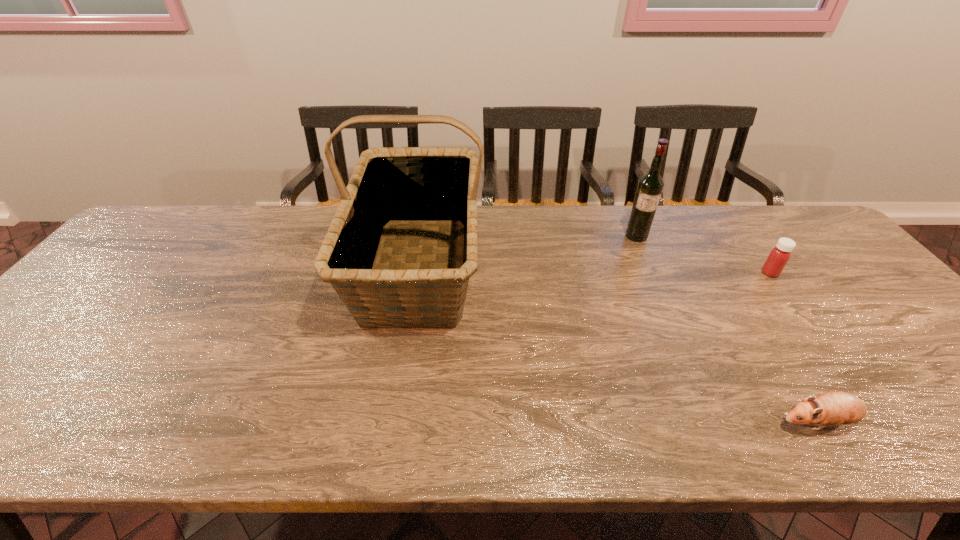
Locate an element on the screen. This screenshot has width=960, height=540. free spot between the shortest object and the second tallest object is located at coordinates (727, 329).

The image size is (960, 540). What are the coordinates of `object that is the second closest to the second shortest object` in the screenshot? It's located at (833, 408).

Where is `object that is the third nearest to the leftmost object`? Image resolution: width=960 pixels, height=540 pixels. object that is the third nearest to the leftmost object is located at coordinates (779, 256).

This screenshot has width=960, height=540. Identify the location of vacant region that satisfies the following two spatial constraints: 1. by the handle of the rightmost object; 2. on the right side of the leftmost object. (418, 273).

You are a GUI agent. You are given a task and a screenshot of the screen. Output one action in this format:
    pyautogui.click(x=<x>, y=<y>)
    Task: Click on the free space that satisfies the following two spatial constraints: 1. on the front and back of the second tallest object; 2. on the left side of the medicine
    The image size is (960, 540).
    Given the screenshot: What is the action you would take?
    pyautogui.click(x=653, y=273)

Where is `free space that satisfies the following two spatial constraints: 1. by the handle of the medicine; 2. on the right side of the basket`? This screenshot has width=960, height=540. free space that satisfies the following two spatial constraints: 1. by the handle of the medicine; 2. on the right side of the basket is located at coordinates (418, 273).

Identify the location of vacant space that satisfies the following two spatial constraints: 1. on the front and back of the medicine; 2. on the left side of the second tallest object. (653, 273).